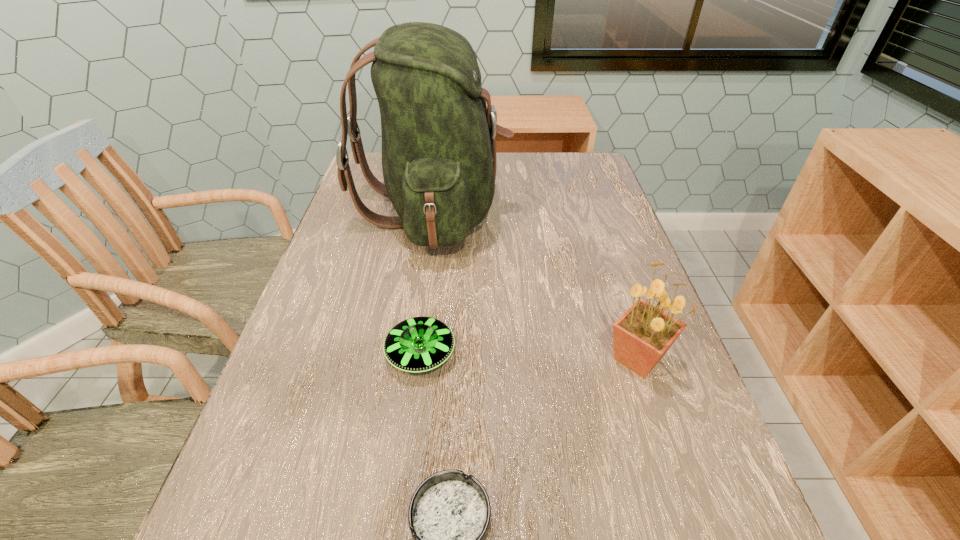
You are a GUI agent. You are given a task and a screenshot of the screen. Output one action in this format:
    pyautogui.click(x=<x>, y=<y>)
    Task: Click on the tallest object
    
    Given the screenshot: What is the action you would take?
    pyautogui.click(x=439, y=162)

The height and width of the screenshot is (540, 960). I want to click on the farthest object, so click(439, 162).

The height and width of the screenshot is (540, 960). I want to click on the rightmost object, so click(x=644, y=333).

Find the location of a particular element. This screenshot has width=960, height=540. the third shortest object is located at coordinates click(x=644, y=333).

At what (x,y) coordinates should I click in order to perform the action: click on the second shortest object. Please return your answer as a coordinate pair (x, y). The image size is (960, 540). Looking at the image, I should click on (418, 344).

Locate an element on the screen. The image size is (960, 540). free space located 0.270m on the open flap of the backpack is located at coordinates (607, 211).

Locate an element on the screen. Image resolution: width=960 pixels, height=540 pixels. vacant space located 0.240m at the front of the third shortest object with flowers visible is located at coordinates (x=695, y=533).

Locate an element on the screen. vacant space located on the front of the third tallest object is located at coordinates (408, 457).

Where is `object that is positioned at the far edge`? object that is positioned at the far edge is located at coordinates (439, 162).

Where is `object located at the left edge`? Image resolution: width=960 pixels, height=540 pixels. object located at the left edge is located at coordinates (439, 162).